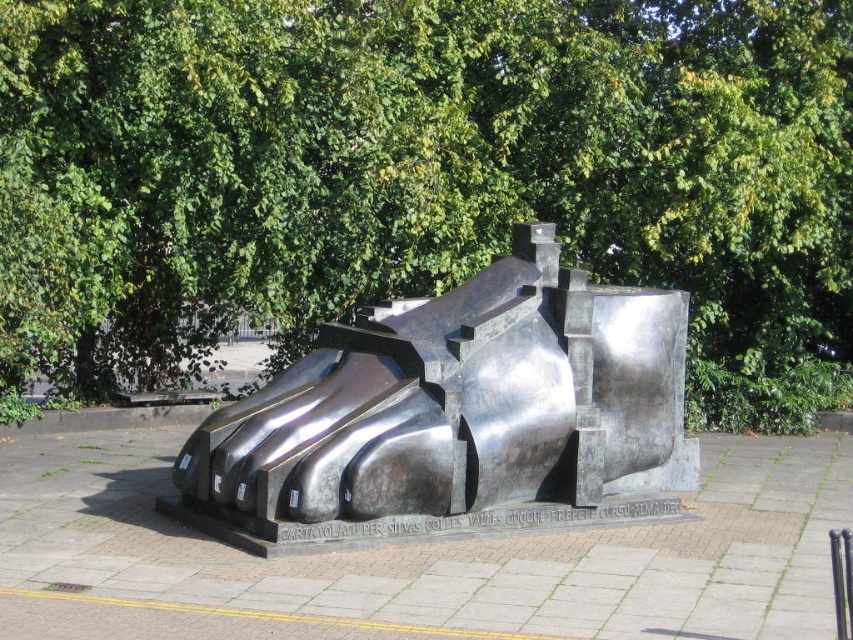
You are standing in front of the sculpture and want to take a photo that includes both the green leafy tree at upper center and the polished bronze sculpture at center. Which object should you position to your left to capture both in the frame?

To capture both the green leafy tree at upper center and the polished bronze sculpture at center in the frame, you should position the polished bronze sculpture at center to your left since the green leafy tree at upper center is located to the right of it.

You are an artist planning to paint the scene. You want to ensure the green leafy tree at upper center and the polished bronze sculpture at center are proportionally accurate. Which object should you make wider in your painting?

Answer: The green leafy tree at upper center should be made wider in the painting since its width is larger than the polished bronze sculpture at center.